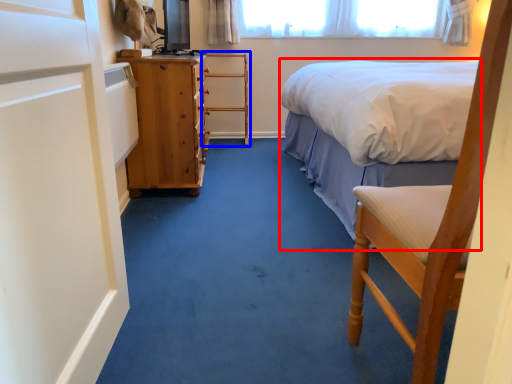
Question: Which object is further to the camera taking this photo, bed (highlighted by a red box) or armchair (highlighted by a blue box)?

Choices:
 (A) bed
 (B) armchair

Answer: (B)